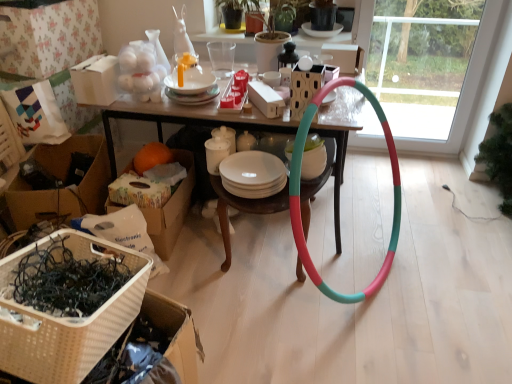
Question: Is wooden table at center facing towards orange fuzzy at lower left?

Choices:
 (A) yes
 (B) no

Answer: (A)

Question: Can you confirm if wooden table at center is shorter than orange fuzzy at lower left?

Choices:
 (A) yes
 (B) no

Answer: (B)

Question: Is wooden table at center at the left side of orange fuzzy at lower left?

Choices:
 (A) yes
 (B) no

Answer: (B)

Question: Does wooden table at center have a larger size compared to orange fuzzy at lower left?

Choices:
 (A) no
 (B) yes

Answer: (B)

Question: Is wooden table at center to the right of orange fuzzy at lower left from the viewer's perspective?

Choices:
 (A) yes
 (B) no

Answer: (A)

Question: Is wooden table at center facing away from orange fuzzy at lower left?

Choices:
 (A) yes
 (B) no

Answer: (B)

Question: From the image's perspective, is green matte plant at upper center under wooden table at center?

Choices:
 (A) yes
 (B) no

Answer: (B)

Question: From the image's perspective, is green matte plant at upper center over wooden table at center?

Choices:
 (A) no
 (B) yes

Answer: (B)

Question: Can you confirm if green matte plant at upper center is positioned to the right of wooden table at center?

Choices:
 (A) no
 (B) yes

Answer: (A)

Question: Is green matte plant at upper center bigger than wooden table at center?

Choices:
 (A) no
 (B) yes

Answer: (A)

Question: Is green matte plant at upper center wider than wooden table at center?

Choices:
 (A) yes
 (B) no

Answer: (B)

Question: Considering the relative sizes of green matte plant at upper center and wooden table at center in the image provided, is green matte plant at upper center shorter than wooden table at center?

Choices:
 (A) no
 (B) yes

Answer: (B)

Question: Are white paper bag at upper left, which is the 3th box from right to left, and white woven basket at lower left making contact?

Choices:
 (A) yes
 (B) no

Answer: (B)